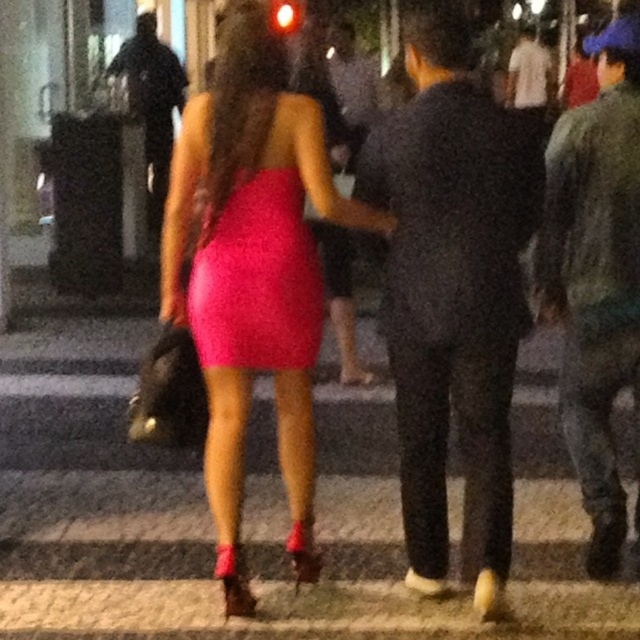
Does matte pink dress at center have a greater height compared to black leather jacket at upper left?

No, matte pink dress at center is not taller than black leather jacket at upper left.

Is point (250, 202) positioned behind point (152, 189)?

No, it is in front of (152, 189).

The height and width of the screenshot is (640, 640). What do you see at coordinates (253, 273) in the screenshot?
I see `matte pink dress at center` at bounding box center [253, 273].

Identify the location of matte pink dress at center. click(253, 273).

The height and width of the screenshot is (640, 640). In order to click on pink fabric dress at center in this screenshot , I will do `click(252, 500)`.

Between pink fabric dress at center and white cotton shirt at upper center, which one is positioned higher?

Positioned higher is white cotton shirt at upper center.

This screenshot has height=640, width=640. Identify the location of pink fabric dress at center. (252, 500).

You are a GUI agent. You are given a task and a screenshot of the screen. Output one action in this format:
    pyautogui.click(x=<x>, y=<y>)
    Task: Click on the pink fabric dress at center
    Image resolution: width=640 pixels, height=640 pixels.
    Given the screenshot: What is the action you would take?
    pyautogui.click(x=252, y=500)

Between point (428, 401) and point (292, 371), which one is positioned behind?

The point (292, 371) is behind.

Can you confirm if dark gray suit at center is bigger than matte pink dress at center?

Incorrect, dark gray suit at center is not larger than matte pink dress at center.

The width and height of the screenshot is (640, 640). Identify the location of dark gray suit at center. (452, 296).

Identify the location of dark gray suit at center. This screenshot has width=640, height=640. (452, 296).